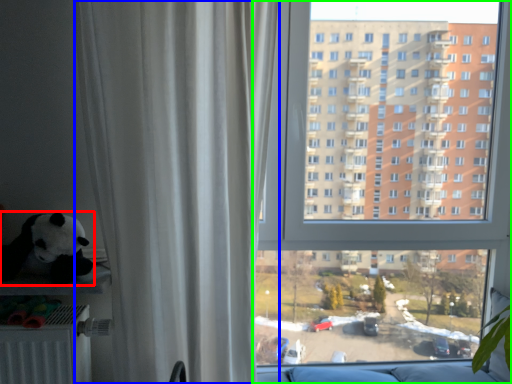
Question: Based on their relative distances, which object is nearer to toy (highlighted by a red box)? Choose from curtain (highlighted by a blue box) and window (highlighted by a green box).

Choices:
 (A) curtain
 (B) window

Answer: (A)